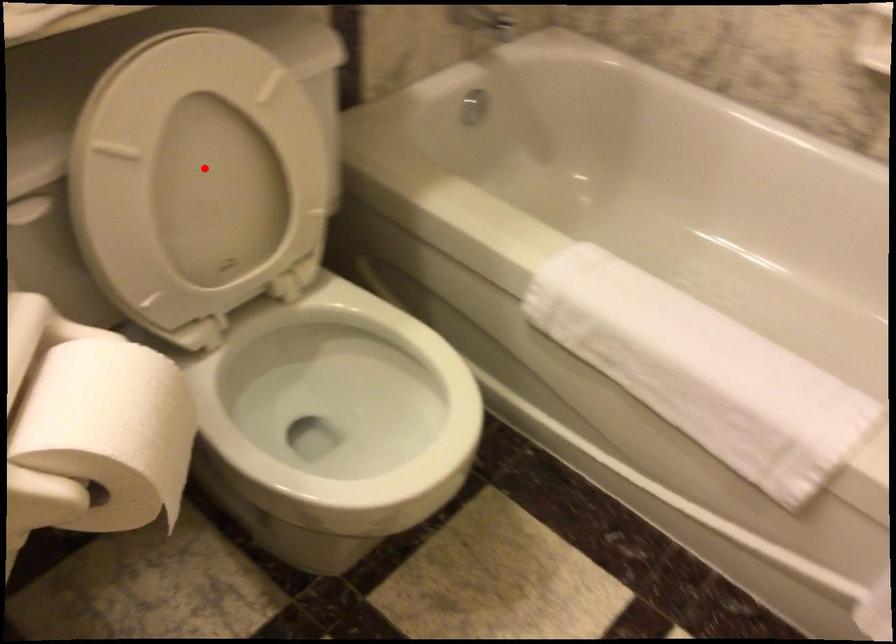
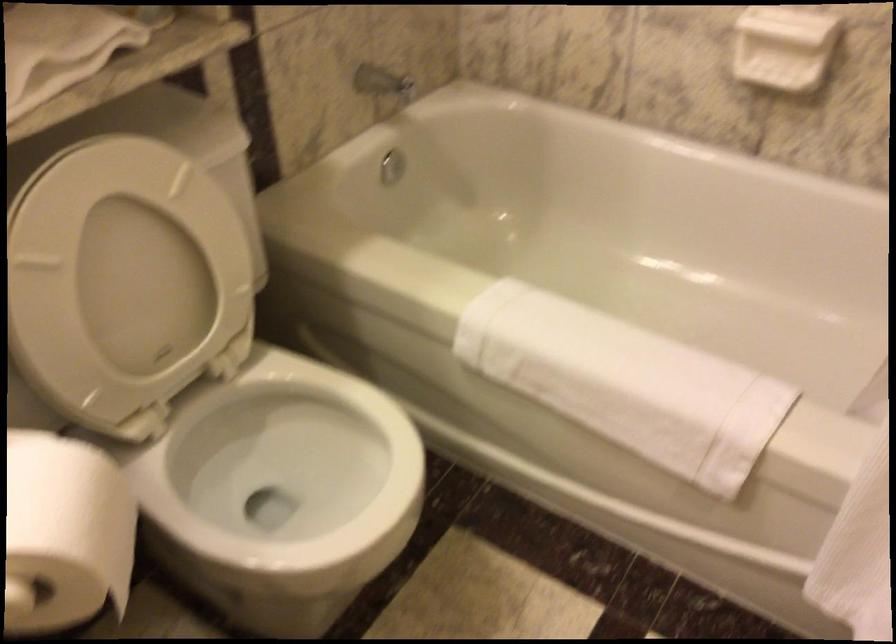
Question: I am providing you with two images of the same scene from different viewpoints. A red point is marked on the first image. Is the red point's position out of view in image 2?

Choices:
 (A) Yes
 (B) No

Answer: (B)